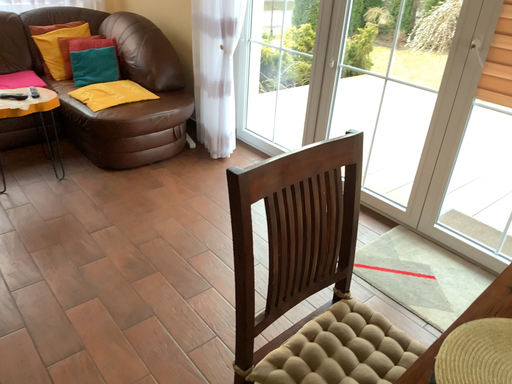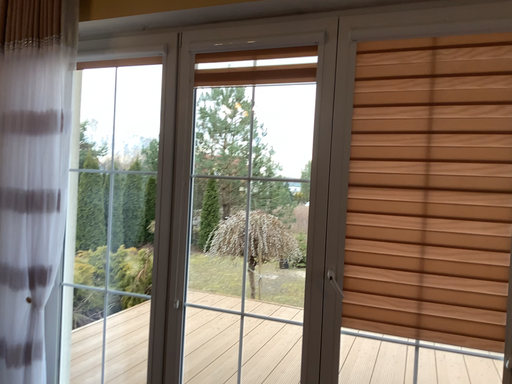
Question: How did the camera likely rotate when shooting the video?

Choices:
 (A) rotated upward
 (B) rotated downward

Answer: (A)